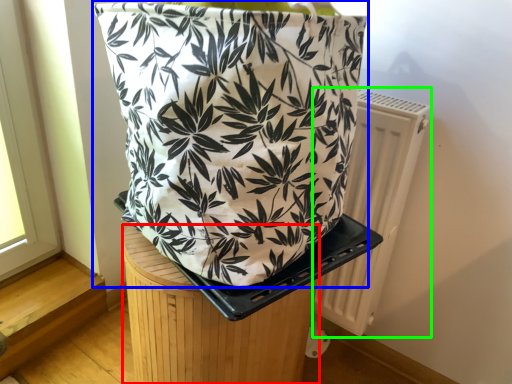
Question: Based on their relative distances, which object is farther from furniture (highlighted by a red box)? Choose from handbag (highlighted by a blue box) and radiator (highlighted by a green box).

Choices:
 (A) handbag
 (B) radiator

Answer: (B)